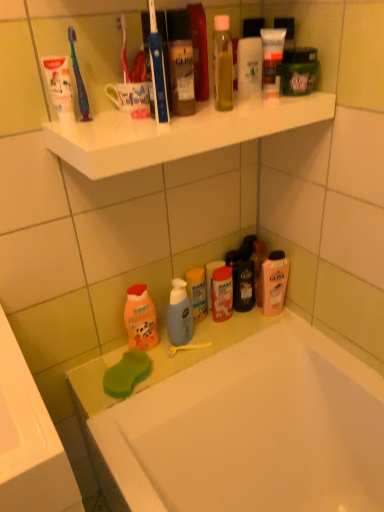
Find the location of a particular element. empty space that is to the right of shiny plastic bottle at upper center, the second toiletry from the top is located at coordinates (246, 108).